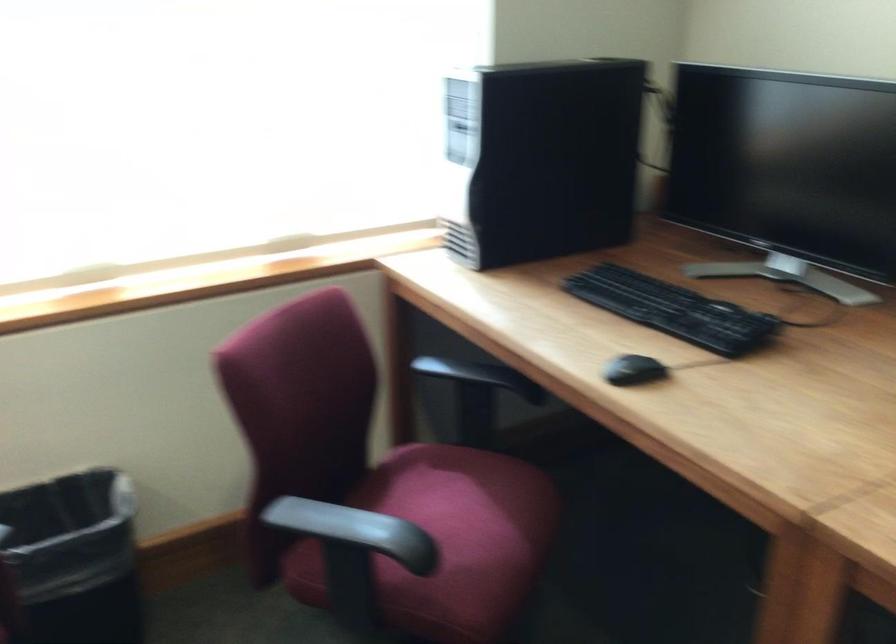
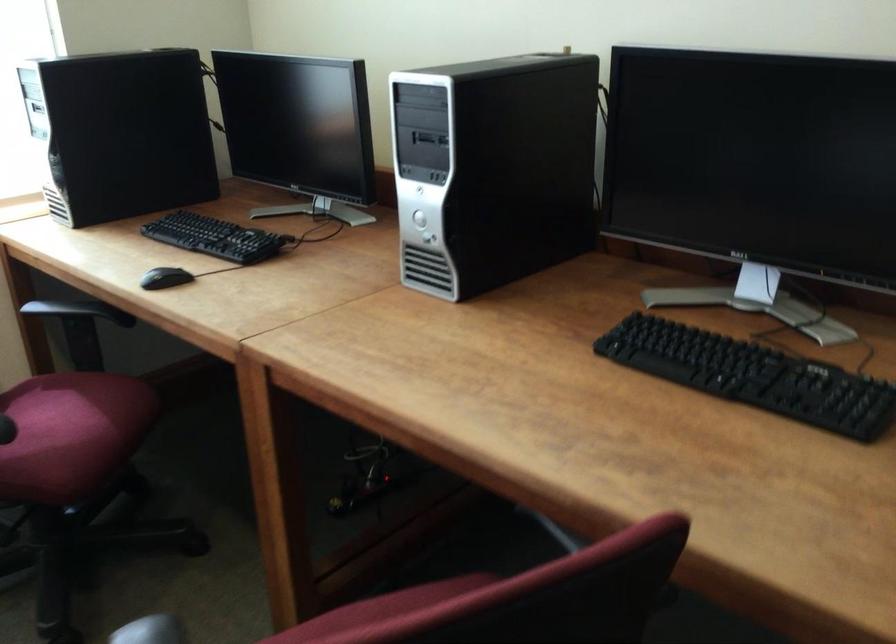
Question: How did the camera likely rotate?

Choices:
 (A) Left
 (B) Right
 (C) Up
 (D) Down

Answer: (B)